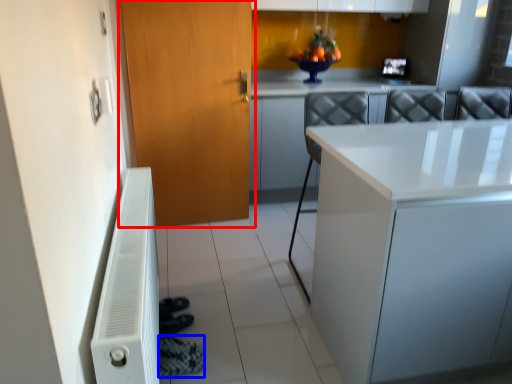
Question: Which of the following is the farthest to the observer, door (highlighted by a red box) or shoe (highlighted by a blue box)?

Choices:
 (A) door
 (B) shoe

Answer: (A)